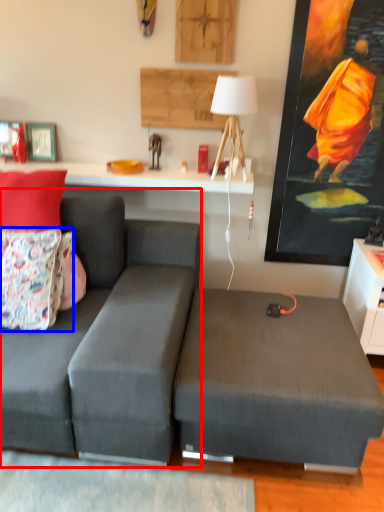
Question: Which object is further to the camera taking this photo, couch (highlighted by a red box) or pillow (highlighted by a blue box)?

Choices:
 (A) couch
 (B) pillow

Answer: (B)